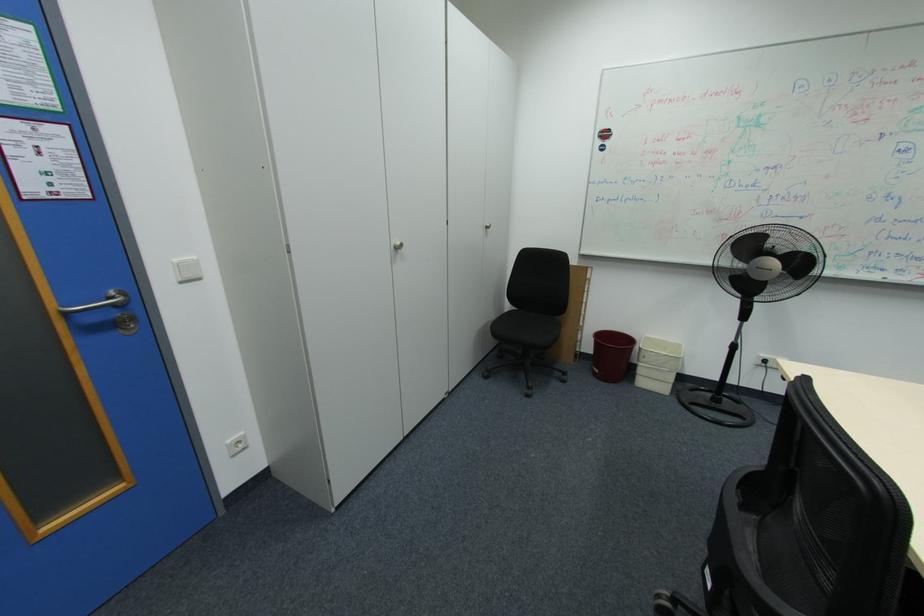
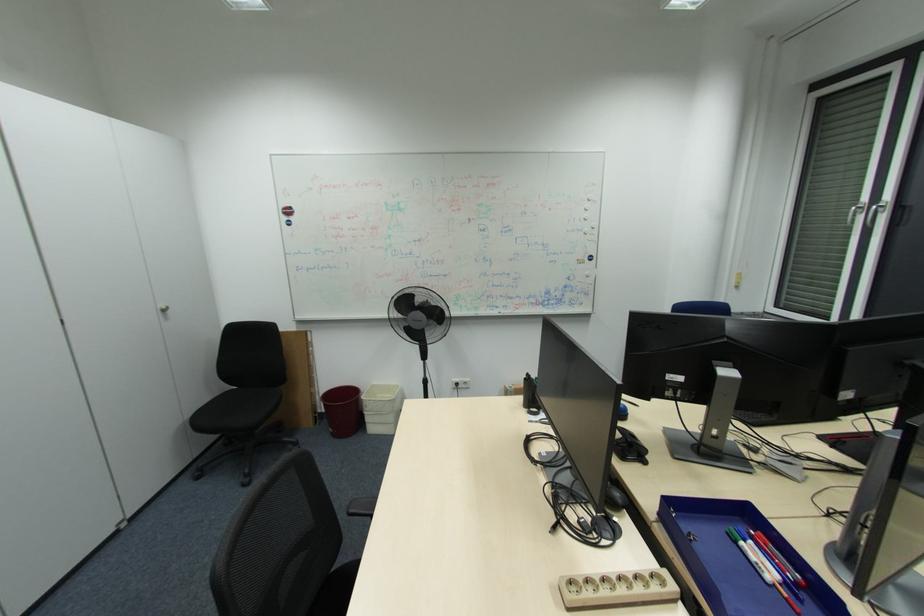
Question: The first image is from the beginning of the video and the second image is from the end. How did the camera likely rotate when shooting the video?

Choices:
 (A) Left
 (B) Right
 (C) Up
 (D) Down

Answer: (B)